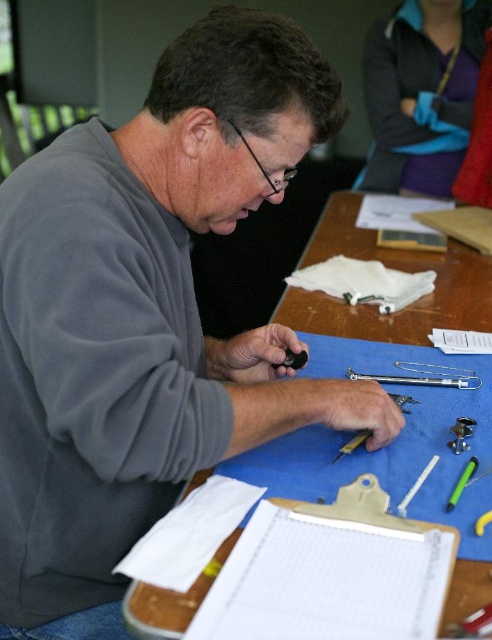
You are organizing the items on the table and need to place the metallic silver screwdriver at center so that it doesn t fall off the table. Considering the blue fabric at center is taller than it, where should you position the screwdriver relative to the blue fabric?

Since the blue fabric at center is taller than the metallic silver screwdriver at center, you should position the screwdriver closer to the edge of the table away from the blue fabric to prevent it from falling off.

You are a visitor observing the scene. You notice the white paper at lower center and the chrome metallic syringe at center. Which object takes up more space on the table?

The white paper at lower center is bigger than the chrome metallic syringe at center, so it takes up more space on the table.

You are a photographer who needs to place a small sticker exactly at the center of the gray fleece at center. According to the coordinates provided, where should you place the sticker?

The sticker should be placed at the coordinates point (92, 376), which is the exact 2D location of the gray fleece at center.